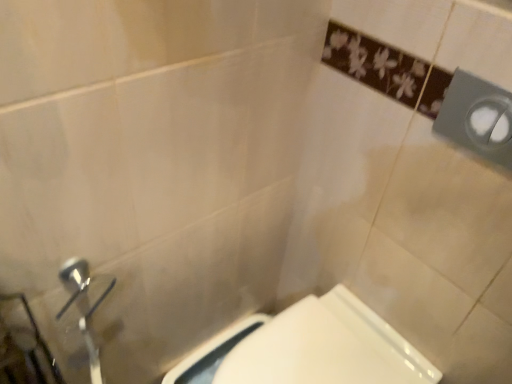
What is the approximate width of white glossy toilet at lower center?

19.35 inches.

The height and width of the screenshot is (384, 512). I want to click on white glossy toilet at lower center, so click(x=309, y=348).

What do you see at coordinates (309, 348) in the screenshot?
I see `white glossy toilet at lower center` at bounding box center [309, 348].

You are a GUI agent. You are given a task and a screenshot of the screen. Output one action in this format:
    pyautogui.click(x=<x>, y=<y>)
    Task: Click on the white glossy toilet at lower center
    This screenshot has width=512, height=384.
    Given the screenshot: What is the action you would take?
    pyautogui.click(x=309, y=348)